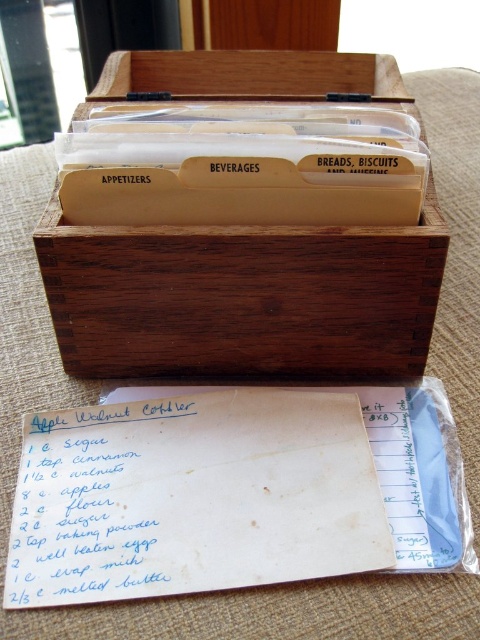
Question: Which object is farther from the camera taking this photo?

Choices:
 (A) white handwritten paper at center
 (B) wooden box at center

Answer: (B)

Question: Which object is closer to the camera taking this photo?

Choices:
 (A) white handwritten paper at center
 (B) wooden box at center

Answer: (A)

Question: Can you confirm if wooden box at center is positioned to the right of white handwritten paper at center?

Choices:
 (A) yes
 (B) no

Answer: (A)

Question: Is wooden box at center wider than white handwritten paper at center?

Choices:
 (A) yes
 (B) no

Answer: (A)

Question: Where is wooden box at center located in relation to white handwritten paper at center in the image?

Choices:
 (A) right
 (B) left

Answer: (A)